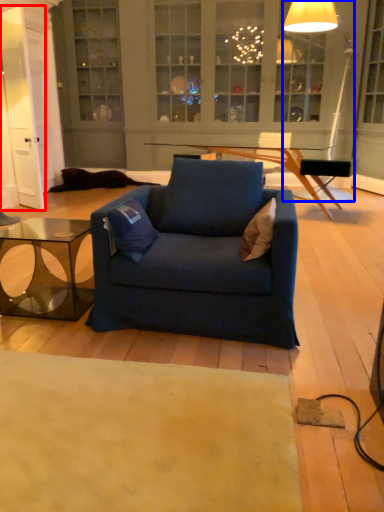
Question: Among these objects, which one is nearest to the camera, glass door (highlighted by a red box) or lamp (highlighted by a blue box)?

Choices:
 (A) glass door
 (B) lamp

Answer: (B)